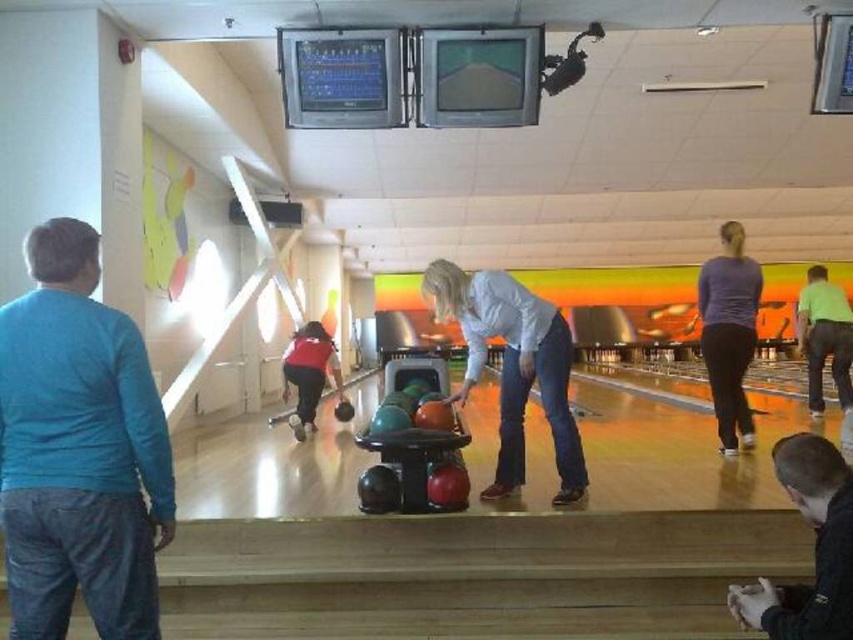
You are a bowling ball delivery person who needs to place two bowling balls on the lane. The first is the matte orange bowling ball at center and the second is the green matte bowling ball at center. The minimum distance between them should be 4 meters to avoid interference. Can you confirm if the current placement meets this requirement?

The matte orange bowling ball at center is 4.26 meters from the green matte bowling ball at center, so yes, the current placement meets the requirement since the distance exceeds the minimum 4 meters.

Looking at this image, you are a bowling ball delivery person who needs to place two bowling balls on the lane. The lane has a maximum weight limit of 8 kilograms per ball. The matte orange bowling ball at center weighs 7.5 kilograms, and the red fabric bowling ball at center weighs 7.2 kilograms. Can you safely place both balls on the lane without exceeding the weight limit?

Both the matte orange bowling ball at center and the red fabric bowling ball at center are within the 8 kilogram limit. The matte orange bowling ball at center weighs 7.5 kilograms and the red fabric bowling ball at center weighs 7.2 kilograms, so placing both on the lane is safe.